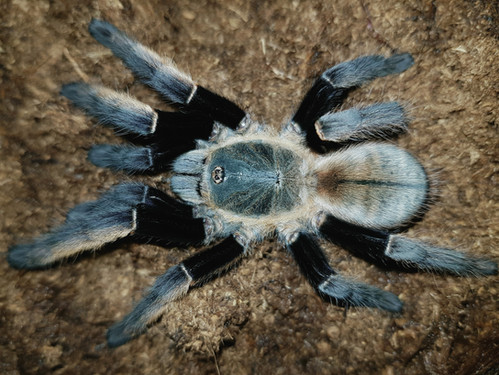
What are the coordinates of `the bottom legs` in the screenshot? It's located at (183, 274), (347, 282).